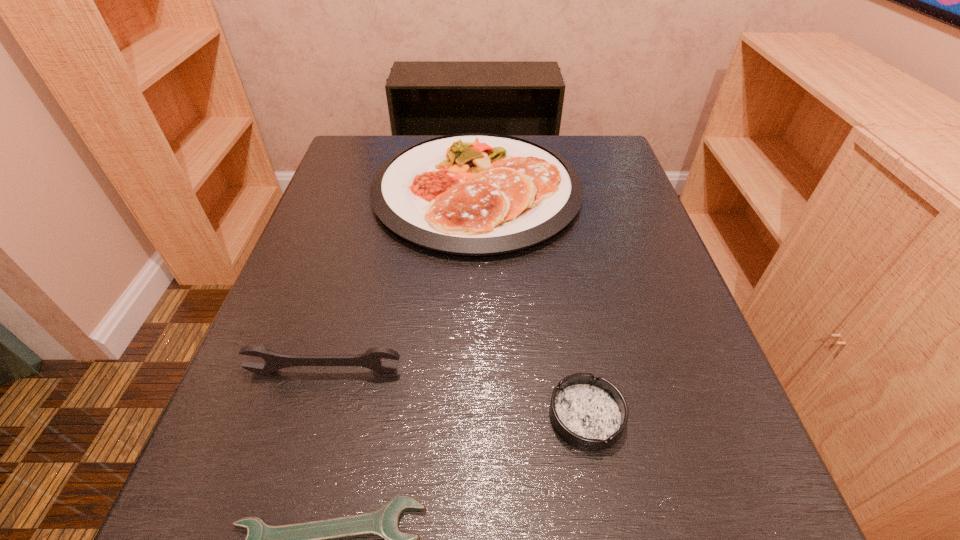
At what (x,y) coordinates should I click in order to perform the action: click on dish. Please return your answer as a coordinate pair (x, y). Looking at the image, I should click on (475, 194).

At what (x,y) coordinates should I click in order to perform the action: click on the second farthest object. Please return your answer as a coordinate pair (x, y). The height and width of the screenshot is (540, 960). Looking at the image, I should click on (370, 359).

Locate an element on the screen. Image resolution: width=960 pixels, height=540 pixels. the taller wrench is located at coordinates (370, 359).

Where is `the second nearest object`? This screenshot has height=540, width=960. the second nearest object is located at coordinates (590, 413).

This screenshot has width=960, height=540. I want to click on the third tallest object, so click(590, 413).

Where is `vacant space situated on the front of the dish`? vacant space situated on the front of the dish is located at coordinates (476, 283).

In order to click on vacant space situated 0.060m on the open ends of the second farthest object in this screenshot , I will do `click(313, 409)`.

The image size is (960, 540). I want to click on vacant space situated 0.080m on the front of the second nearest object, so click(605, 517).

At what (x,y) coordinates should I click in order to perform the action: click on object at the far edge. Please return your answer as a coordinate pair (x, y). Looking at the image, I should click on (475, 194).

This screenshot has height=540, width=960. I want to click on dish present at the left edge, so click(x=475, y=194).